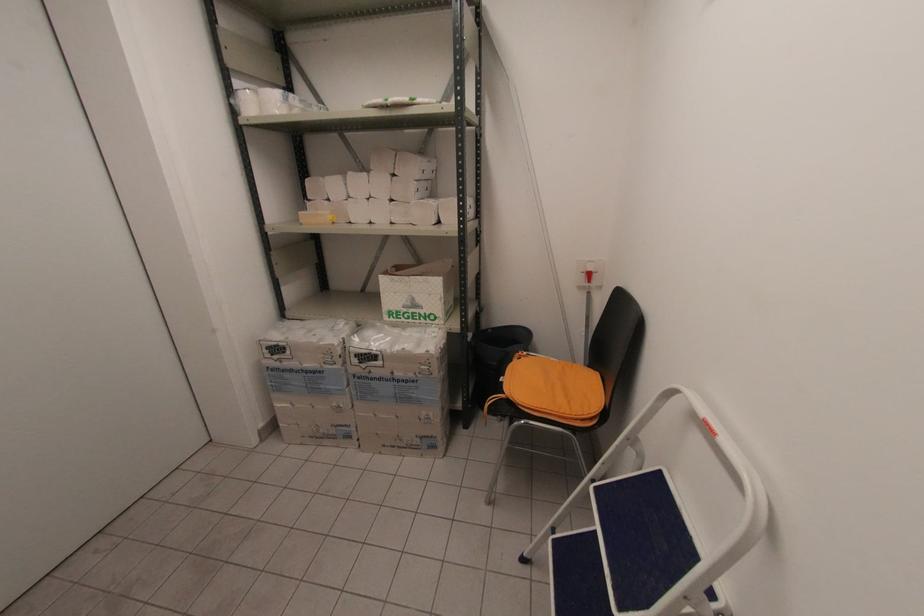
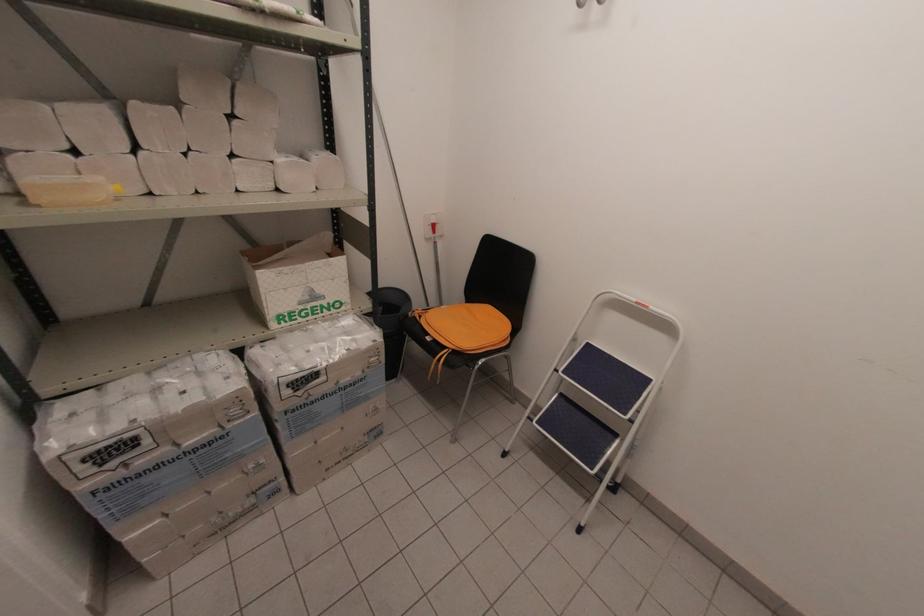
Find the pixel in the second image that matches the point at 661,472 in the first image.

(589, 344)